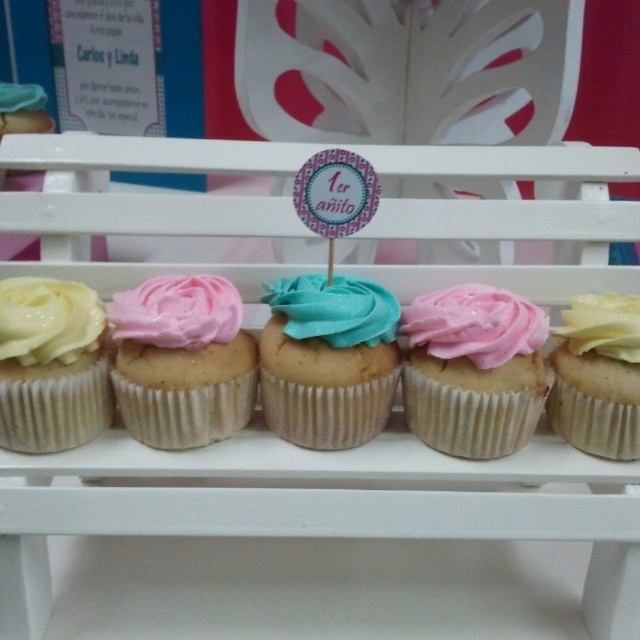
Question: Among these objects, which one is farthest from the camera?

Choices:
 (A) white matte icing at right
 (B) yellow matte cupcake at right

Answer: (B)

Question: Can you confirm if white glossy frosting at left is smaller than white matte icing at right?

Choices:
 (A) no
 (B) yes

Answer: (A)

Question: Which point is closer to the camera?

Choices:
 (A) matte yellow cupcake at left
 (B) pink matte frosting at center
 (C) white glossy frosting at left

Answer: (C)

Question: Which object is positioned closest to the pink frosted cupcake at center?

Choices:
 (A) pink glossy cupcake at center
 (B) teal glossy icing at center
 (C) pink matte frosting at center
 (D) yellow matte cupcake at right

Answer: (C)

Question: From the image, what is the correct spatial relationship of pink glossy cupcake at center in relation to pink frosted cupcake at center?

Choices:
 (A) right
 (B) left

Answer: (A)

Question: Is pink glossy cupcake at center in front of pink frosted cupcake at center?

Choices:
 (A) no
 (B) yes

Answer: (A)